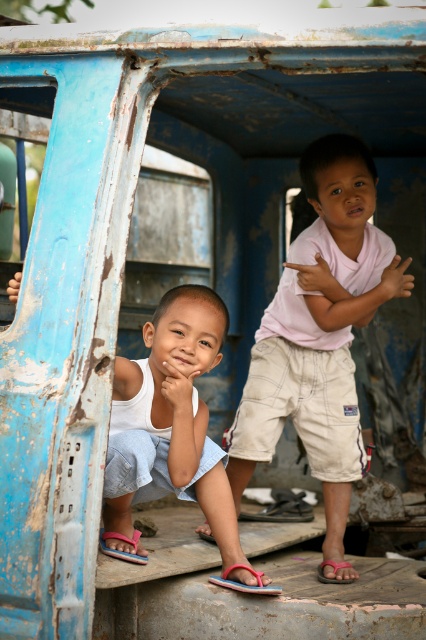
Based on the coordinates provided in the scene, where exactly is the white denim shorts at lower left located?

The white denim shorts at lower left is located at the 2D coordinates point (170, 419).

You are trying to locate the pink cotton shirt at upper right in the image of the weathered vehicle. Based on the coordinates provided, where exactly would you find it?

The pink cotton shirt at upper right is located at point (319,333), which is in the upper right area of the image.

You are a tailor who needs to determine which item requires more fabric for a repair. Based on the image, which item is larger in size between the pink cotton shirt at upper right and the pink fabric sandal at lower center?

The pink cotton shirt at upper right is bigger than the pink fabric sandal at lower center, so it would require more fabric for a repair.